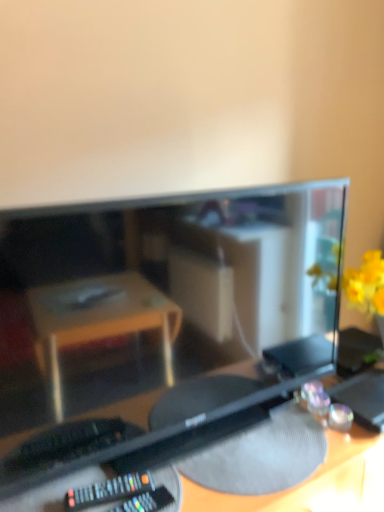
Locate an element on the screen. The image size is (384, 512). free area behind black plastic remote at lower left is located at coordinates (120, 467).